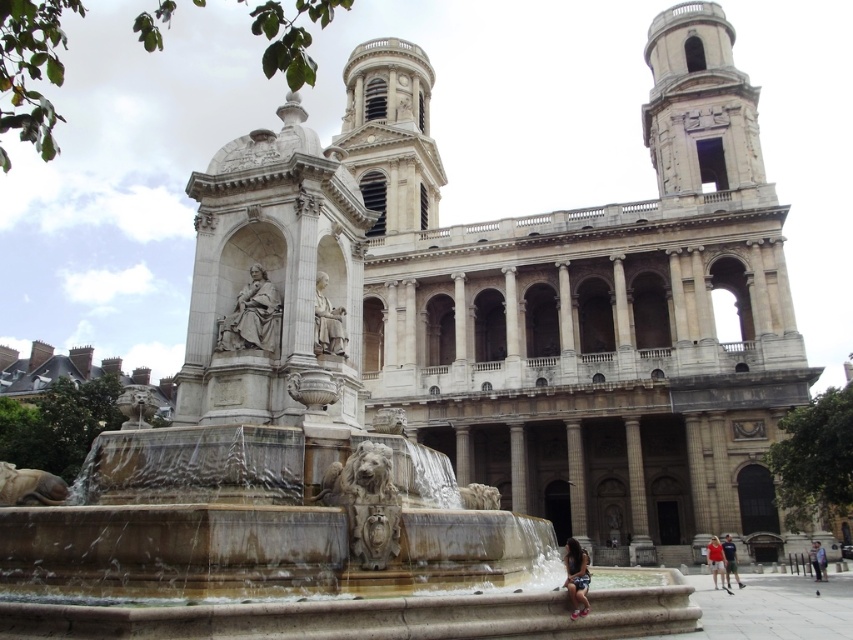
Does red cotton shirt at lower right have a lesser width compared to dark blue jeans at lower right?

Yes, red cotton shirt at lower right is thinner than dark blue jeans at lower right.

Does red cotton shirt at lower right appear on the right side of dark blue jeans at lower right?

Incorrect, red cotton shirt at lower right is not on the right side of dark blue jeans at lower right.

Between point (709, 556) and point (724, 548), which one is positioned in front?

Positioned in front is point (724, 548).

Locate an element on the screen. Image resolution: width=853 pixels, height=640 pixels. red cotton shirt at lower right is located at coordinates (717, 561).

Is marble church at center to the left of red cotton shirt at lower right from the viewer's perspective?

Correct, you'll find marble church at center to the left of red cotton shirt at lower right.

Which of these two, marble church at center or red cotton shirt at lower right, stands taller?

marble church at center is taller.

Is point (548, 356) in front of point (712, 552)?

No.

This screenshot has width=853, height=640. What are the coordinates of `marble church at center` in the screenshot? It's located at (589, 310).

Which is more to the right, dark brown leather jacket at lower center or light brown leather jacket at lower right?

Positioned to the right is light brown leather jacket at lower right.

Who is more distant from viewer, [575,593] or [814,547]?

Positioned behind is point [814,547].

Image resolution: width=853 pixels, height=640 pixels. Find the location of `dark brown leather jacket at lower center`. dark brown leather jacket at lower center is located at coordinates point(576,577).